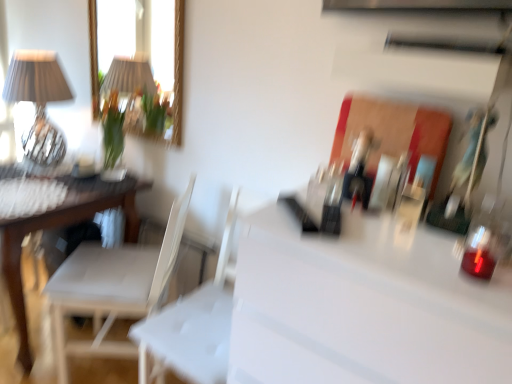
Question: From their relative heights in the image, would you say white glossy counter top at center is taller or shorter than matte glass table lamp at upper left?

Choices:
 (A) tall
 (B) short

Answer: (A)

Question: From a real-world perspective, is white glossy counter top at center above or below matte glass table lamp at upper left?

Choices:
 (A) below
 (B) above

Answer: (A)

Question: Which object is positioned closest to the white glossy counter top at center?

Choices:
 (A) matte glass table lamp at upper left
 (B) white plastic swivel chair at center
 (C) white fabric chair at left

Answer: (B)

Question: Considering the real-world distances, which object is closest to the white fabric chair at left?

Choices:
 (A) white plastic swivel chair at center
 (B) matte glass table lamp at upper left
 (C) white glossy counter top at center

Answer: (A)